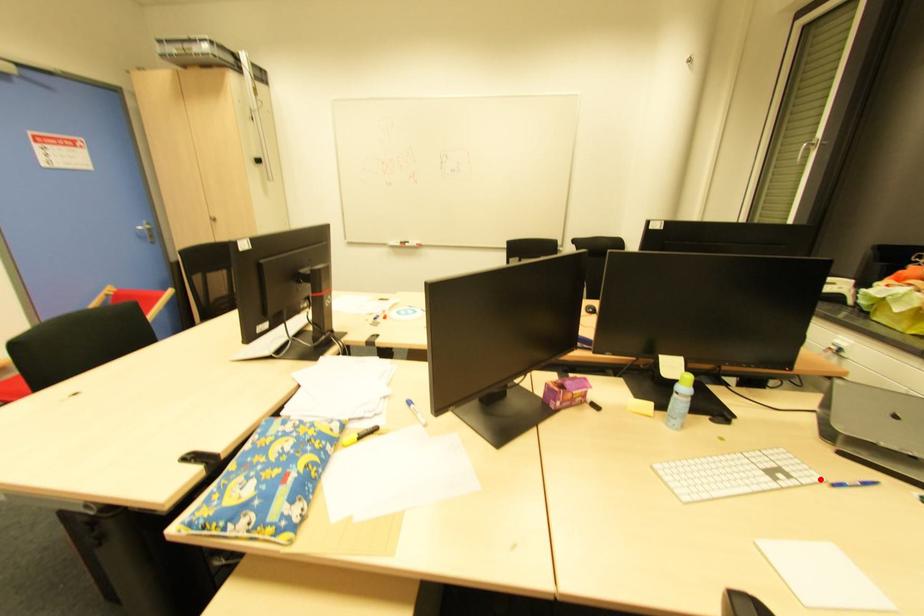
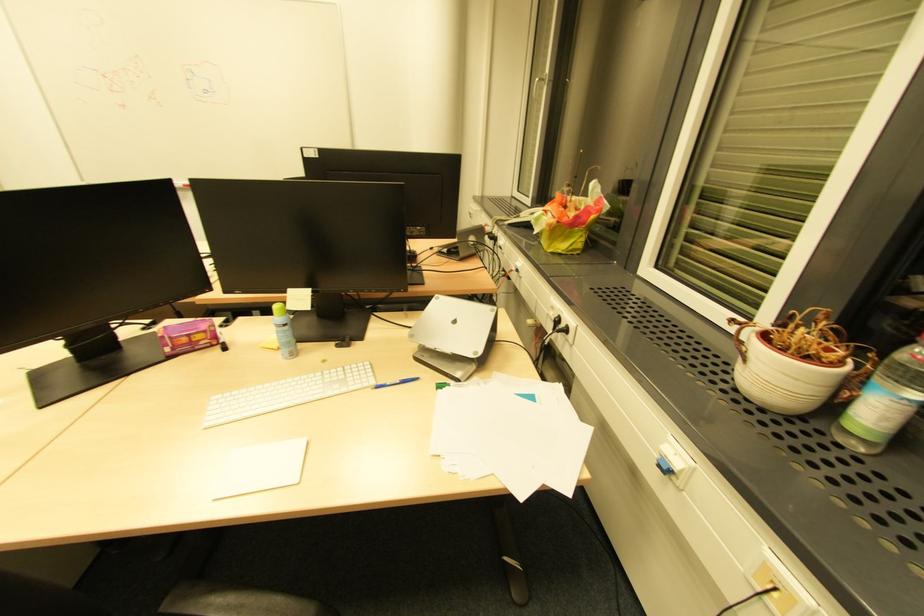
The point at the highlighted location is marked in the first image. Where is the corresponding point in the second image?

(373, 384)